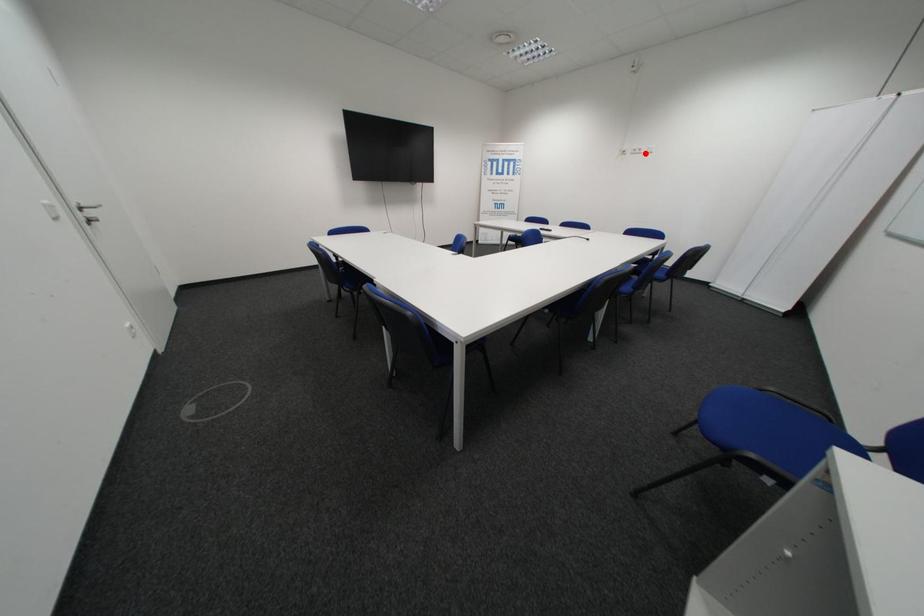
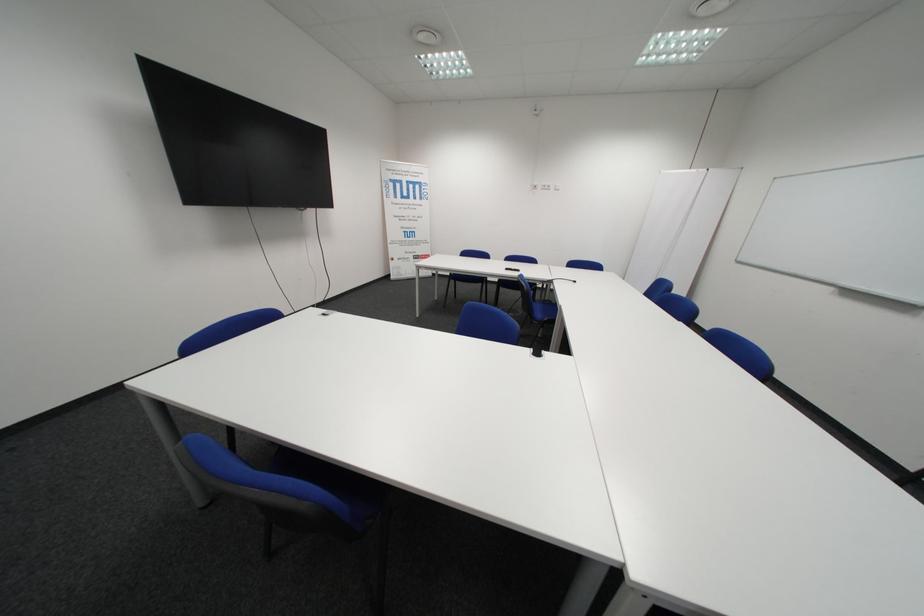
Find the pixel in the second image that matches the highlighted location in the first image.

(554, 188)